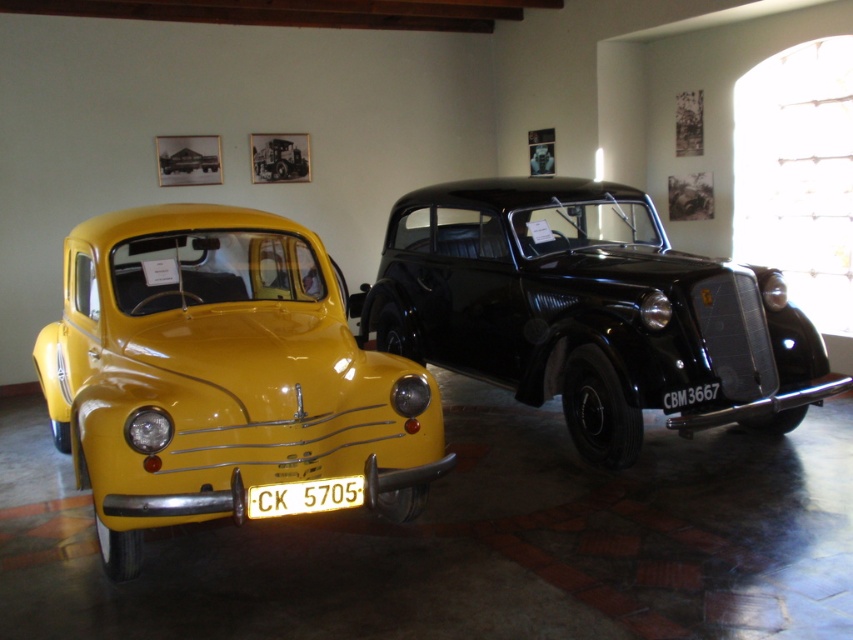
You are a tour guide giving a tour of a car museum. You want to point out the matte yellow car at left and the shiny black car at center to your visitors. Which car is positioned to the right side of the other?

The shiny black car at center is positioned to the right of the matte yellow car at left.

From the picture: You are a tour guide explaining the layout of the exhibition to visitors. You mention the shiny black car at center and the matte yellow car at center. Which car is located above the other?

The shiny black car at center is positioned under the matte yellow car at center, so the matte yellow car at center is above the shiny black car at center.

You are a tour guide leading a group through the car exhibition. You need to move a 2.0 meter long cart between the matte yellow car at left and the shiny black car at center to serve refreshments. Can the cart fit through the space between them?

The distance between the matte yellow car at left and the shiny black car at center is 2.19 meters. Since the cart is 2.0 meters long, it can fit through the space between them as the distance is slightly larger than the cart.